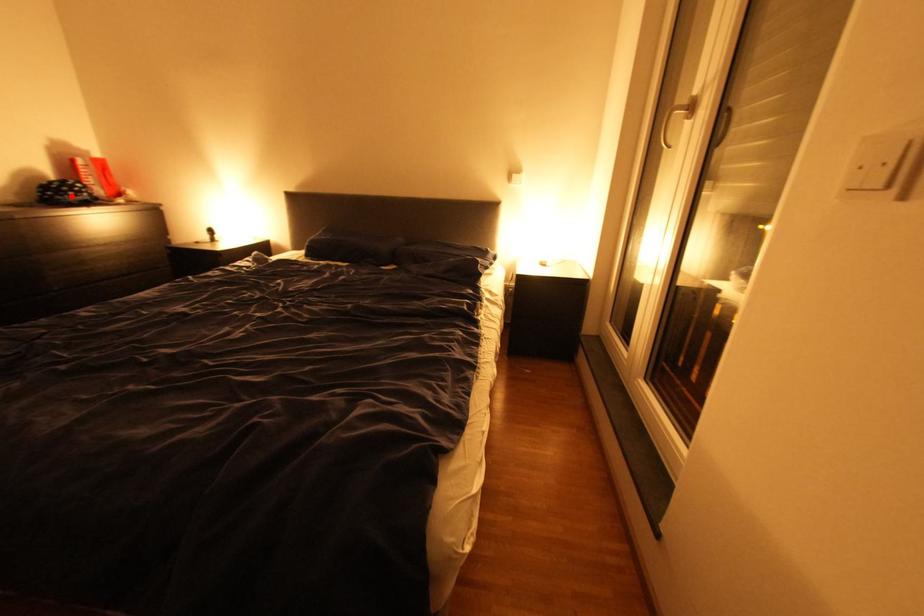
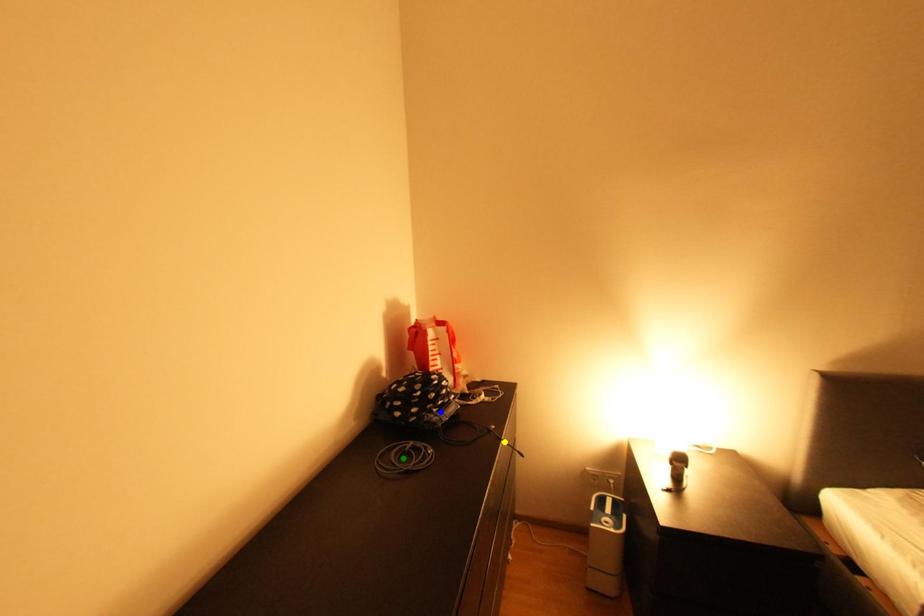
Question: I am providing you with two images of the same scene from different viewpoints. A red point is marked on the first image. You are given multiple points on the second image. Which point in image 2 is actually the same real-world point as the red point in image 1?

Choices:
 (A) blue point
 (B) yellow point
 (C) green point

Answer: (A)